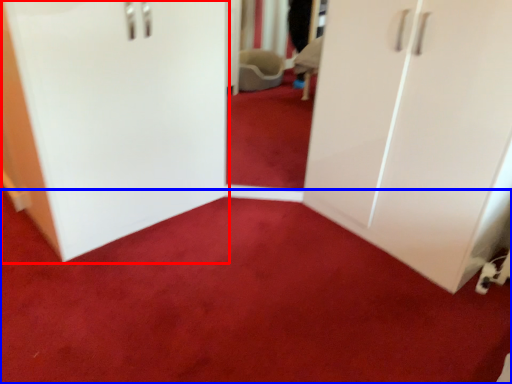
Question: Which of the following is the farthest to the observer, door (highlighted by a red box) or plain (highlighted by a blue box)?

Choices:
 (A) door
 (B) plain

Answer: (A)